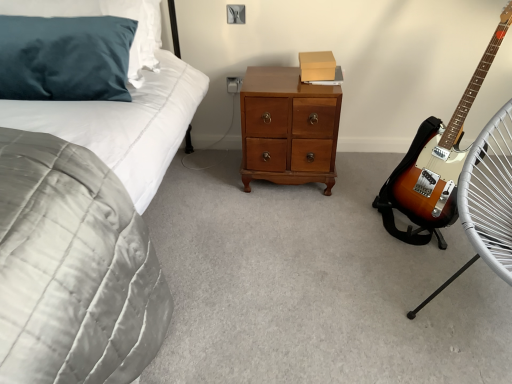
I want to click on free space that is to the left of satin wood guitar at right, so click(345, 219).